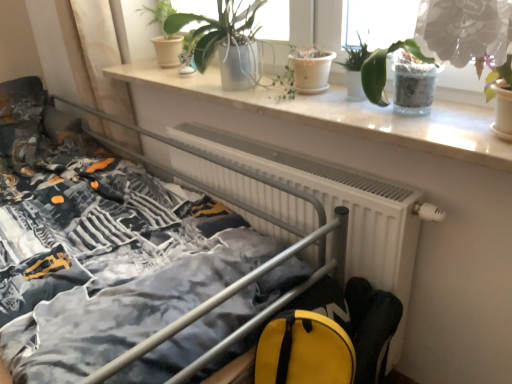
Where is `unoccupied region to the right of translucent glass pot at upper right, arranged as the fourth houseplant when viewed from the left`? The image size is (512, 384). unoccupied region to the right of translucent glass pot at upper right, arranged as the fourth houseplant when viewed from the left is located at coordinates (455, 107).